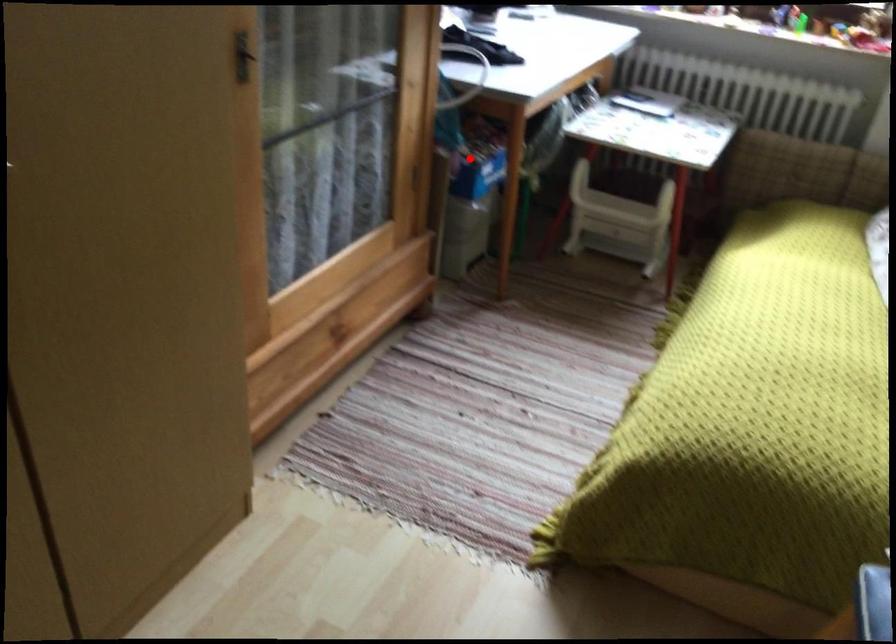
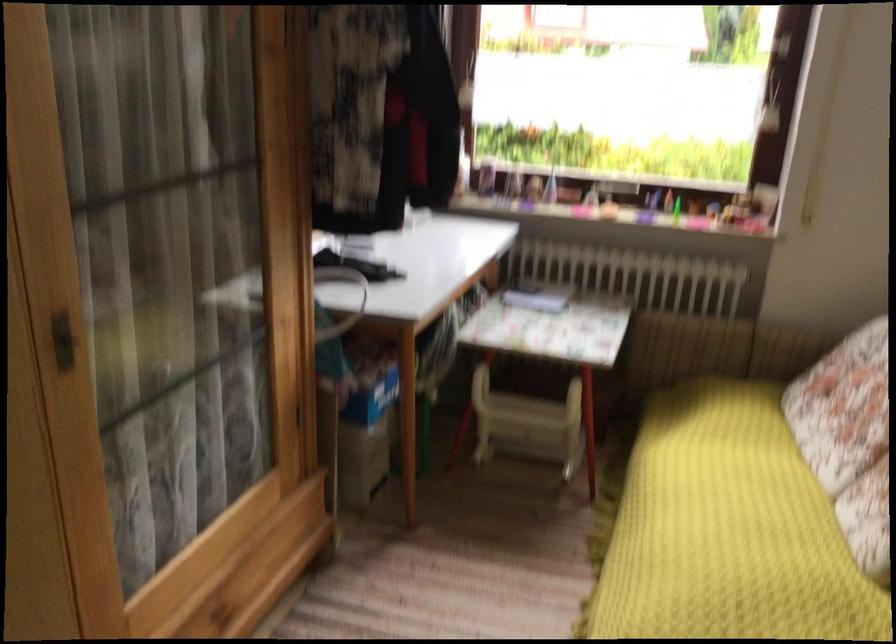
Question: I am providing you with two images of the same scene from different viewpoints. A red point is marked on the first image. Is the red point's position out of view in image 2?

Choices:
 (A) Yes
 (B) No

Answer: (B)